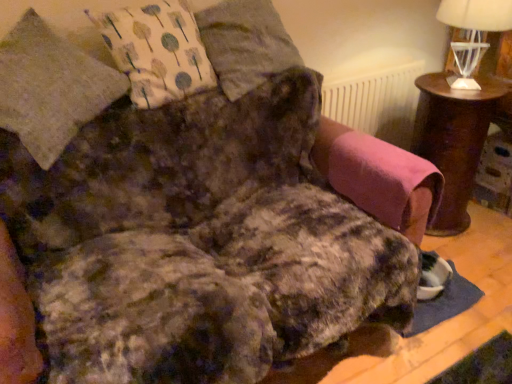
What do you see at coordinates (157, 51) in the screenshot? I see `white fabric with tree pattern at upper left` at bounding box center [157, 51].

What is the approximate width of pink fabric swivel chair at right?

15.75 inches.

Describe the element at coordinates (473, 33) in the screenshot. This screenshot has height=384, width=512. I see `white glass table lamp at upper right` at that location.

You are a GUI agent. You are given a task and a screenshot of the screen. Output one action in this format:
    pyautogui.click(x=<x>, y=<y>)
    Task: Click on the fluffy gray pillow at upper left, which is the second pillow from right to left
    This screenshot has height=384, width=512.
    Given the screenshot: What is the action you would take?
    pyautogui.click(x=50, y=87)

From a real-world perspective, between white textured radiator at upper center and pink fabric swivel chair at right, who is vertically lower?

From a 3D spatial view, white textured radiator at upper center is below.

Is white textured radiator at upper center touching pink fabric swivel chair at right?

They are not placed beside each other.

Find the location of a particular element. This screenshot has width=512, height=384. swivel chair that is on the left side of white textured radiator at upper center is located at coordinates (379, 178).

Based on the photo, which is more distant, [366,88] or [373,195]?

The point [366,88] is more distant.

Which of these two, fluffy gray pillow at upper center, which is counted as the 2th pillow, starting from the left, or fluffy gray pillow at upper left, which is the first pillow in left-to-right order, is smaller?

fluffy gray pillow at upper center, which is counted as the 2th pillow, starting from the left, is smaller.

Can you confirm if fluffy gray pillow at upper center, the 1th pillow positioned from the right, is thinner than fluffy gray pillow at upper left, which is the second pillow from right to left?

Yes.

Can you confirm if fluffy gray pillow at upper center, which is counted as the 2th pillow, starting from the left, is shorter than fluffy gray pillow at upper left, which is the second pillow from right to left?

Yes, fluffy gray pillow at upper center, which is counted as the 2th pillow, starting from the left, is shorter than fluffy gray pillow at upper left, which is the second pillow from right to left.

In the image, is brown wooden table at right on the left side or the right side of fluffy gray pillow at upper left, which is the second pillow from right to left?

Clearly, brown wooden table at right is on the right of fluffy gray pillow at upper left, which is the second pillow from right to left, in the image.

Choose the correct answer: Is brown wooden table at right inside fluffy gray pillow at upper left, which is the first pillow in left-to-right order, or outside it?

brown wooden table at right exists outside the volume of fluffy gray pillow at upper left, which is the first pillow in left-to-right order.

In terms of size, does brown wooden table at right appear bigger or smaller than fluffy gray pillow at upper left, which is the second pillow from right to left?

In the image, brown wooden table at right appears to be smaller than fluffy gray pillow at upper left, which is the second pillow from right to left.

How much distance is there between fluffy gray pillow at upper left, which is the first pillow in left-to-right order, and white glass table lamp at upper right?

A distance of 1.63 meters exists between fluffy gray pillow at upper left, which is the first pillow in left-to-right order, and white glass table lamp at upper right.

Relative to white glass table lamp at upper right, is fluffy gray pillow at upper left, which is the second pillow from right to left, in front or behind?

fluffy gray pillow at upper left, which is the second pillow from right to left, is in front of white glass table lamp at upper right.

Are fluffy gray pillow at upper left, which is the second pillow from right to left, and white glass table lamp at upper right making contact?

No, fluffy gray pillow at upper left, which is the second pillow from right to left, is not with white glass table lamp at upper right.

From the image's perspective, which object appears higher, pink fabric swivel chair at right or fluffy gray pillow at upper left, which is the first pillow in left-to-right order?

fluffy gray pillow at upper left, which is the first pillow in left-to-right order, appears higher in the image.

Would you say pink fabric swivel chair at right is to the left or to the right of fluffy gray pillow at upper left, which is the first pillow in left-to-right order, in the picture?

In the image, pink fabric swivel chair at right appears on the right side of fluffy gray pillow at upper left, which is the first pillow in left-to-right order.

Who is smaller, pink fabric swivel chair at right or fluffy gray pillow at upper left, which is the second pillow from right to left?

Smaller between the two is pink fabric swivel chair at right.

Consider the image. Is there a large distance between pink fabric swivel chair at right and fluffy gray pillow at upper left, which is the second pillow from right to left?

No, pink fabric swivel chair at right is not far from fluffy gray pillow at upper left, which is the second pillow from right to left.

Is white fabric with tree pattern at upper left to the right of white glass table lamp at upper right from the viewer's perspective?

No.

Is white fabric with tree pattern at upper left located outside white glass table lamp at upper right?

white fabric with tree pattern at upper left lies outside white glass table lamp at upper right's area.

Does white fabric with tree pattern at upper left turn towards white glass table lamp at upper right?

No.

Does point (208, 71) come closer to viewer compared to point (463, 59)?

Yes, point (208, 71) is closer to viewer.

Does point (392, 177) come in front of point (280, 44)?

Yes.

Consider the image. In terms of width, does pink fabric swivel chair at right look wider or thinner when compared to fluffy gray pillow at upper center, the 1th pillow positioned from the right?

Clearly, pink fabric swivel chair at right has less width compared to fluffy gray pillow at upper center, the 1th pillow positioned from the right.

Is pink fabric swivel chair at right directly adjacent to fluffy gray pillow at upper center, the 1th pillow positioned from the right?

No, pink fabric swivel chair at right is not with fluffy gray pillow at upper center, the 1th pillow positioned from the right.

From the picture: Considering the positions of objects pink fabric swivel chair at right and fluffy gray pillow at upper center, which is counted as the 2th pillow, starting from the left, in the image provided, who is more to the left, pink fabric swivel chair at right or fluffy gray pillow at upper center, which is counted as the 2th pillow, starting from the left,?

Positioned to the left is fluffy gray pillow at upper center, which is counted as the 2th pillow, starting from the left.

What are the coordinates of `swivel chair in front of the white textured radiator at upper center` in the screenshot? It's located at (379, 178).

Where is `pillow below the fluffy gray pillow at upper center, the 1th pillow positioned from the right (from a real-world perspective)`? Image resolution: width=512 pixels, height=384 pixels. pillow below the fluffy gray pillow at upper center, the 1th pillow positioned from the right (from a real-world perspective) is located at coordinates (50, 87).

Based on the photo, when comparing their distances from pink fabric swivel chair at right, does fluffy gray pillow at upper left, which is the first pillow in left-to-right order, or brown wooden table at right seem closer?

Among the two, brown wooden table at right is located nearer to pink fabric swivel chair at right.

From the image, which object appears to be nearer to white fabric with tree pattern at upper left, pink fabric swivel chair at right or white textured radiator at upper center?

pink fabric swivel chair at right is positioned closer to the anchor white fabric with tree pattern at upper left.

Based on the photo, looking at the image, which one is located closer to brown wooden table at right, white textured radiator at upper center or white fabric with tree pattern at upper left?

The object closer to brown wooden table at right is white textured radiator at upper center.

When comparing their distances from white glass table lamp at upper right, does fluffy gray pillow at upper center, the 1th pillow positioned from the right, or pink fabric swivel chair at right seem closer?

pink fabric swivel chair at right is positioned closer to the anchor white glass table lamp at upper right.

Based on their spatial positions, is pink fabric swivel chair at right or brown wooden table at right further from fluffy gray pillow at upper left, which is the first pillow in left-to-right order?

brown wooden table at right lies further to fluffy gray pillow at upper left, which is the first pillow in left-to-right order, than the other object.

Which object lies nearer to the anchor point white fabric with tree pattern at upper left, white glass table lamp at upper right or white textured radiator at upper center?

The object closer to white fabric with tree pattern at upper left is white textured radiator at upper center.

Considering their positions, is fluffy gray pillow at upper center, the 1th pillow positioned from the right, positioned further to fluffy gray pillow at upper left, which is the first pillow in left-to-right order, than pink fabric swivel chair at right?

Based on the image, pink fabric swivel chair at right appears to be further to fluffy gray pillow at upper left, which is the first pillow in left-to-right order.

Consider the image. Based on their spatial positions, is brown wooden table at right or pink fabric swivel chair at right further from fluffy gray pillow at upper center, which is counted as the 2th pillow, starting from the left?

brown wooden table at right is further to fluffy gray pillow at upper center, which is counted as the 2th pillow, starting from the left.

At what (x,y) coordinates should I click in order to perform the action: click on table lamp between fluffy gray pillow at upper center, which is counted as the 2th pillow, starting from the left, and brown wooden table at right from left to right. Please return your answer as a coordinate pair (x, y). Image resolution: width=512 pixels, height=384 pixels. Looking at the image, I should click on (473, 33).

Find the location of a particular element. This screenshot has width=512, height=384. swivel chair situated between fluffy gray pillow at upper left, which is the first pillow in left-to-right order, and white textured radiator at upper center from left to right is located at coordinates (379, 178).

Locate an element on the screen. pillow between white fabric with tree pattern at upper left and white textured radiator at upper center is located at coordinates (245, 44).

This screenshot has width=512, height=384. Find the location of `table lamp between pink fabric swivel chair at right and white textured radiator at upper center along the z-axis`. table lamp between pink fabric swivel chair at right and white textured radiator at upper center along the z-axis is located at coordinates (473, 33).